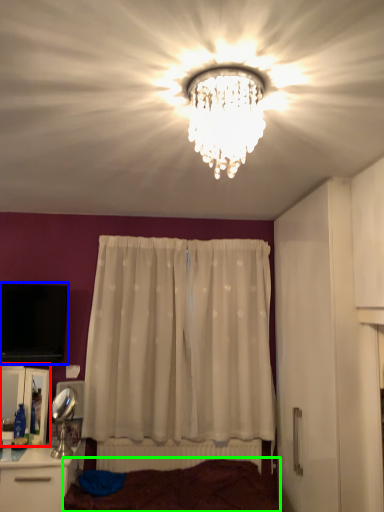
Question: Which object is the farthest from cabinetry (highlighted by a red box)? Choose among these: television (highlighted by a blue box) or bed frame (highlighted by a green box).

Choices:
 (A) television
 (B) bed frame

Answer: (B)